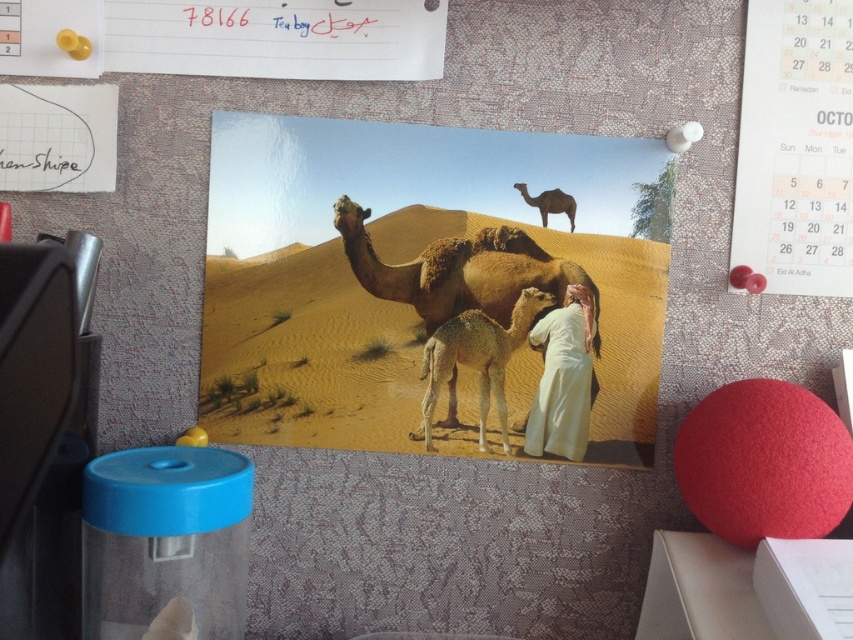
You are an artist who wants to place a new drawing between the white cotton cloth at center and the brown matte camel at upper center on the bulletin board. Based on their sizes, which object should you position your drawing closer to?

The white cotton cloth at center might be wider than the brown matte camel at upper center, so you should position your drawing closer to the brown matte camel at upper center to ensure there is enough space.

You are organizing items on a bulletin board and need to place a new item between the white cotton cloth at center and the calendar on the right. According to the board layout, where should you position the new item?

The white cotton cloth at center is located at point (x=561, y=378), so you should position the new item between this coordinate and the calendar on the right.

You are organizing the bulletin board and need to place a new item between the white cotton cloth at center and the brown fuzzy camel at center. Which object should you move to make space, and why?

You should move the brown fuzzy camel at center because it occupies more space than the white cotton cloth at center, so moving it would create more space for the new item.